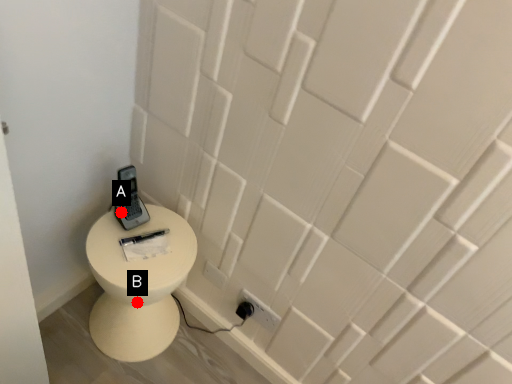
Question: Two points are circled on the image, labeled by A and B beside each circle. Which point is closer to the camera?

Choices:
 (A) A is closer
 (B) B is closer

Answer: (B)